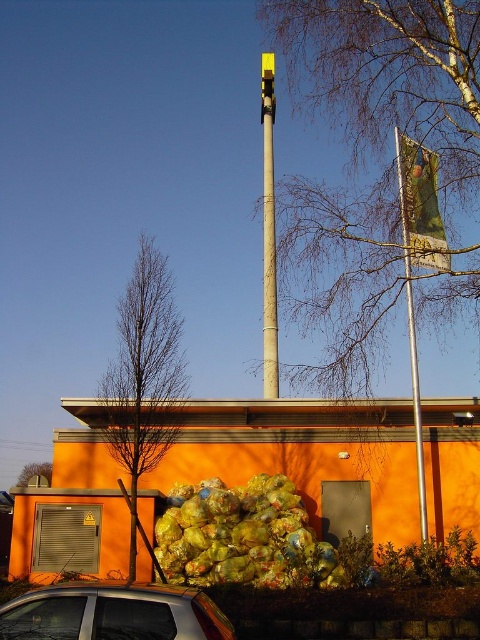
Who is positioned more to the left, bare branches at left or smooth metallic pole at center?

bare branches at left

Which is above, bare branches at left or smooth metallic pole at center?

smooth metallic pole at center

Find the location of a particular element. This screenshot has width=480, height=640. bare branches at left is located at coordinates (144, 380).

Who is more distant from viewer, (263, 216) or (263, 122)?

The point (263, 216) is behind.

Between point (264, 211) and point (261, 60), which one is positioned in front?

Positioned in front is point (264, 211).

The image size is (480, 640). In order to click on smooth metallic pole at center in this screenshot , I will do `click(268, 268)`.

Is bare branches at left smaller than silver metallic flag pole at right?

Actually, bare branches at left might be larger than silver metallic flag pole at right.

Who is positioned more to the right, bare branches at left or silver metallic flag pole at right?

From the viewer's perspective, silver metallic flag pole at right appears more on the right side.

Between point (162, 326) and point (408, 236), which one is positioned behind?

The point (408, 236) is more distant.

Locate an element on the screen. The height and width of the screenshot is (640, 480). bare branches at left is located at coordinates (144, 380).